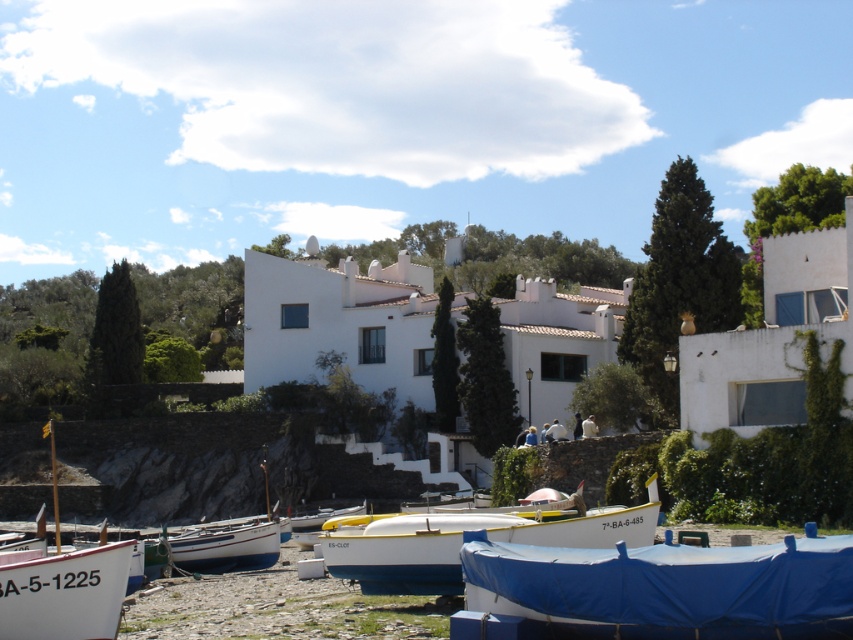
Between white plastic boat at center and white wooden boat at lower left, which one is positioned higher?

Positioned higher is white plastic boat at center.

Is white plastic boat at center further to camera compared to white wooden boat at lower left?

No.

Does point (457, 522) come farther from viewer compared to point (264, 544)?

That is False.

I want to click on white plastic boat at center, so click(467, 540).

Who is more forward, (622, 595) or (459, 584)?

Point (622, 595) is more forward.

Between blue tarpaulin boat at lower center and white plastic boat at center, which one appears on the right side from the viewer's perspective?

blue tarpaulin boat at lower center is more to the right.

What do you see at coordinates (659, 589) in the screenshot?
I see `blue tarpaulin boat at lower center` at bounding box center [659, 589].

The width and height of the screenshot is (853, 640). Find the location of `blue tarpaulin boat at lower center`. blue tarpaulin boat at lower center is located at coordinates (659, 589).

Is the position of blue tarpaulin boat at lower center more distant than that of white matte boat at lower left?

No, blue tarpaulin boat at lower center is in front of white matte boat at lower left.

Based on the photo, between blue tarpaulin boat at lower center and white matte boat at lower left, which one is positioned higher?

blue tarpaulin boat at lower center

Is point (834, 547) behind point (0, 616)?

No, it is in front of (0, 616).

Locate an element on the screen. blue tarpaulin boat at lower center is located at coordinates (659, 589).